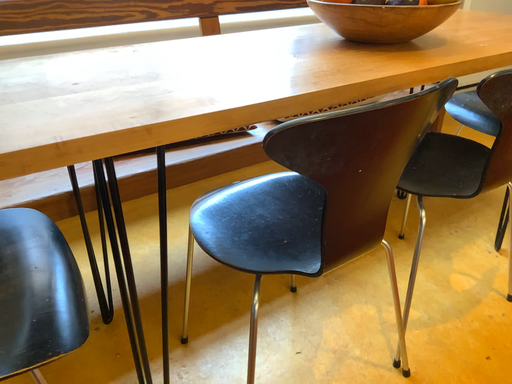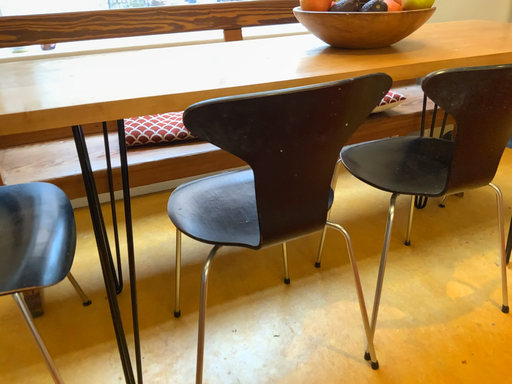
Question: How did the camera likely rotate when shooting the video?

Choices:
 (A) rotated left
 (B) rotated right

Answer: (A)